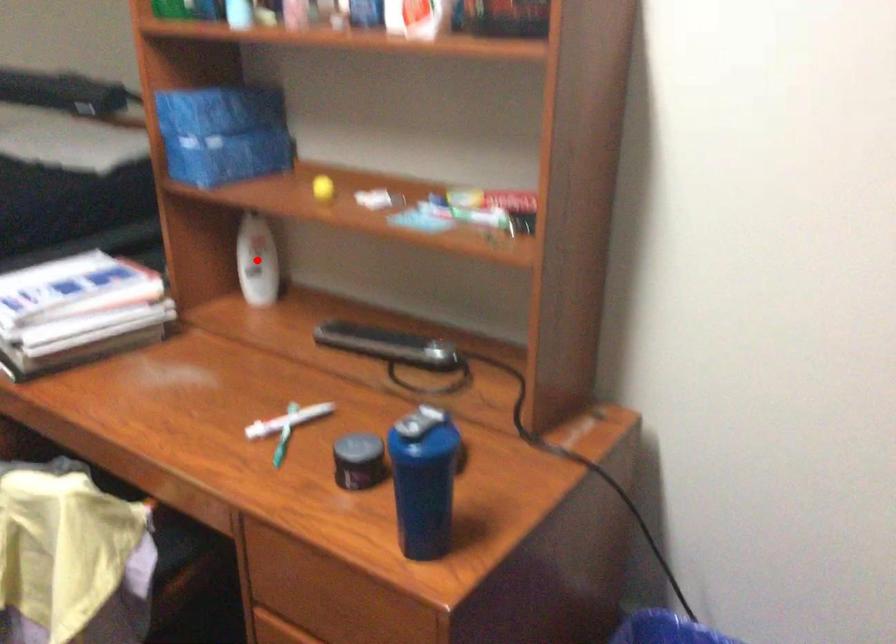
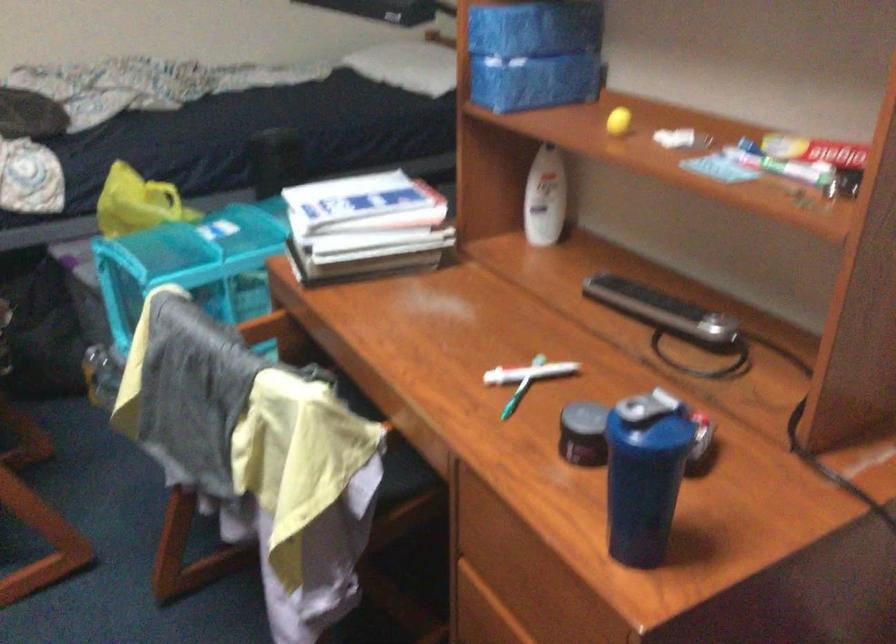
In the second image, find the point that corresponds to the highlighted location in the first image.

(545, 198)